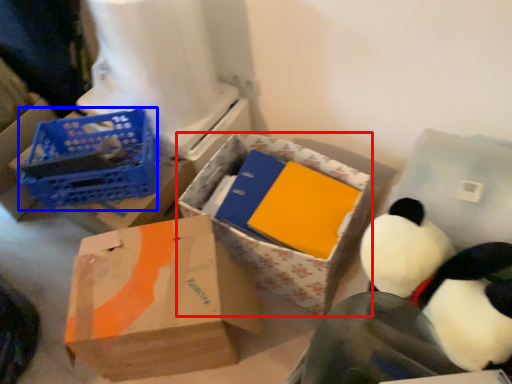
Question: Among these objects, which one is nearest to the camera, box (highlighted by a red box) or basket (highlighted by a blue box)?

Choices:
 (A) box
 (B) basket

Answer: (A)